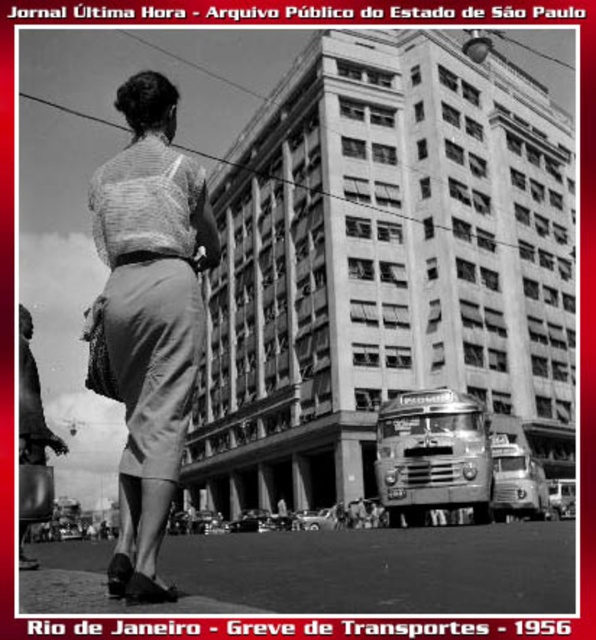
Which of these two, matte gray skirt at center or matte gray skirt at lower left, stands shorter?

Standing shorter between the two is matte gray skirt at lower left.

Can you confirm if matte gray skirt at center is thinner than matte gray skirt at lower left?

No.

The height and width of the screenshot is (640, 596). What do you see at coordinates (149, 317) in the screenshot? I see `matte gray skirt at center` at bounding box center [149, 317].

This screenshot has height=640, width=596. In order to click on matte gray skirt at center in this screenshot , I will do `click(149, 317)`.